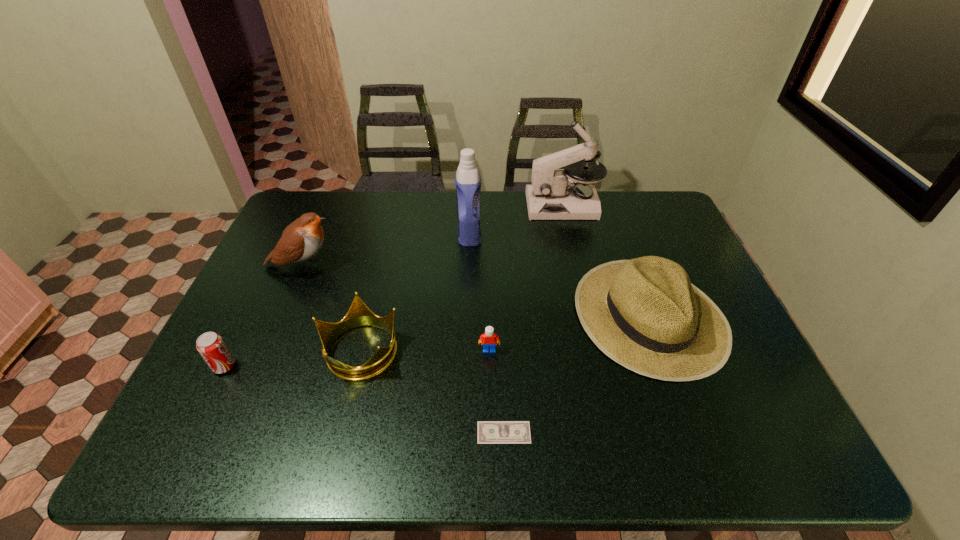
Locate an element on the screen. free spot that satisfies the following two spatial constraints: 1. on the face of the nearest object; 2. on the right side of the Lego is located at coordinates (491, 433).

Identify the location of vacant space that satisfies the following two spatial constraints: 1. at the eyepiece of the microscope; 2. on the front side of the third object from left to right. Image resolution: width=960 pixels, height=540 pixels. (597, 349).

Find the location of `free region that satisfies the following two spatial constraints: 1. at the face of the third object from left to right; 2. on the left side of the bird`. free region that satisfies the following two spatial constraints: 1. at the face of the third object from left to right; 2. on the left side of the bird is located at coordinates (267, 349).